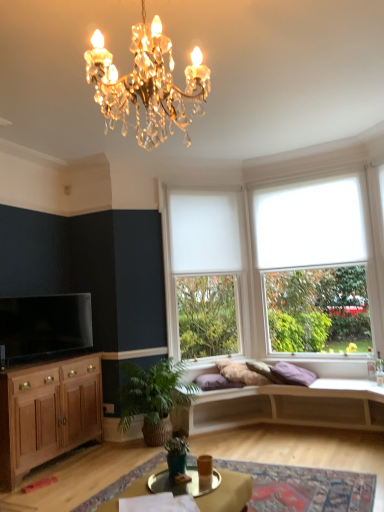
The width and height of the screenshot is (384, 512). I want to click on free spot above white roller blind at right (from a real-world perspective), so click(305, 178).